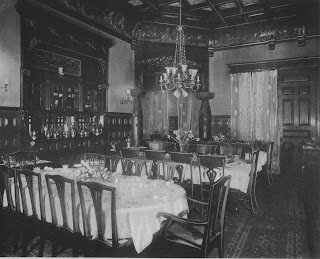
I want to click on table, so click(144, 206).